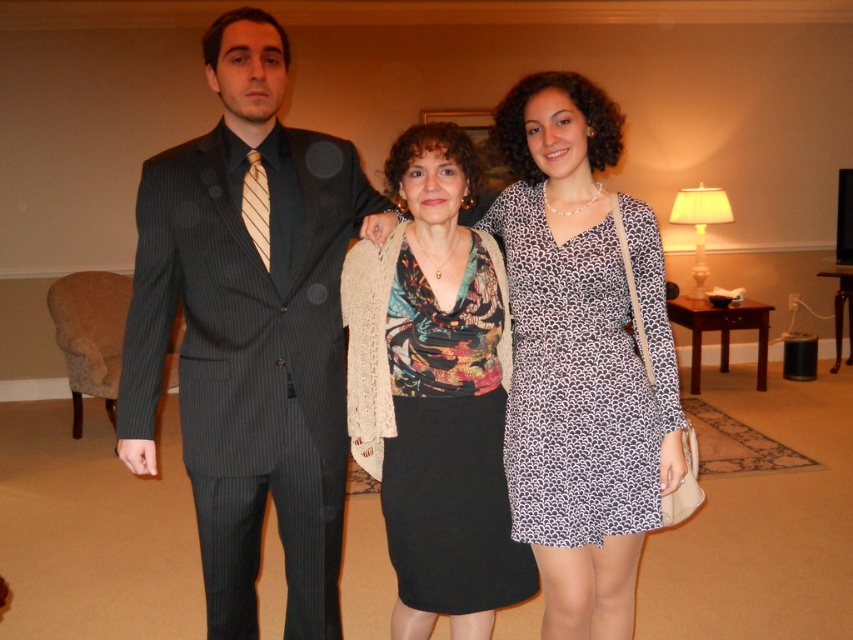
You are organizing a photo shoot and need to arrange the black textured skirt at center and leopard print dress at center in a way that follows the current positioning. Which should be placed to the left of the other?

The black textured skirt at center should be placed to the left of the leopard print dress at center because it is positioned on the left side of it in the original image.

You are a photographer setting up for a group photo. You need to ensure that all subjects are visible. Given that the black textured skirt at center and the leopard print dress at center are both at the center, which one might block the view of the other?

The black textured skirt at center is larger in size than the leopard print dress at center, so it might block the view of the leopard print dress at center.